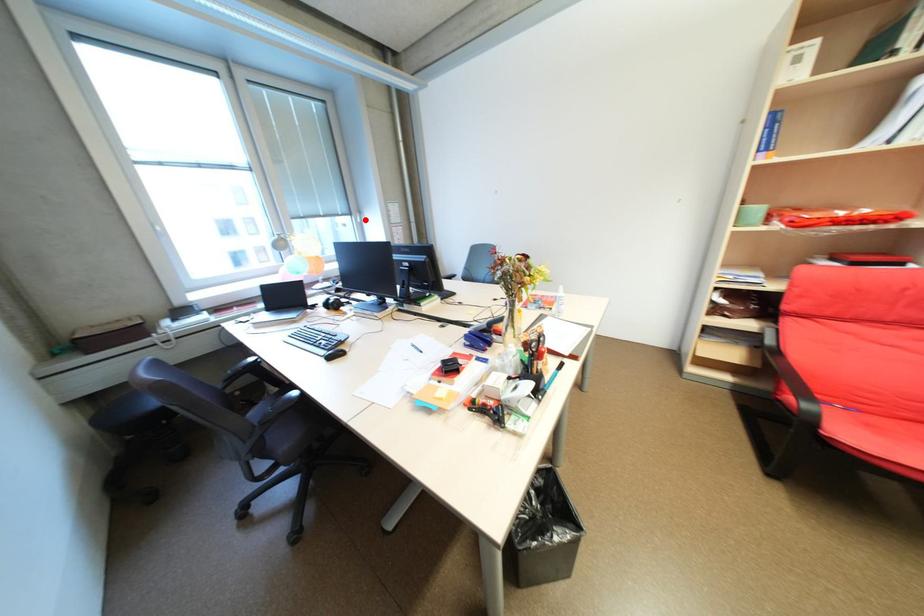
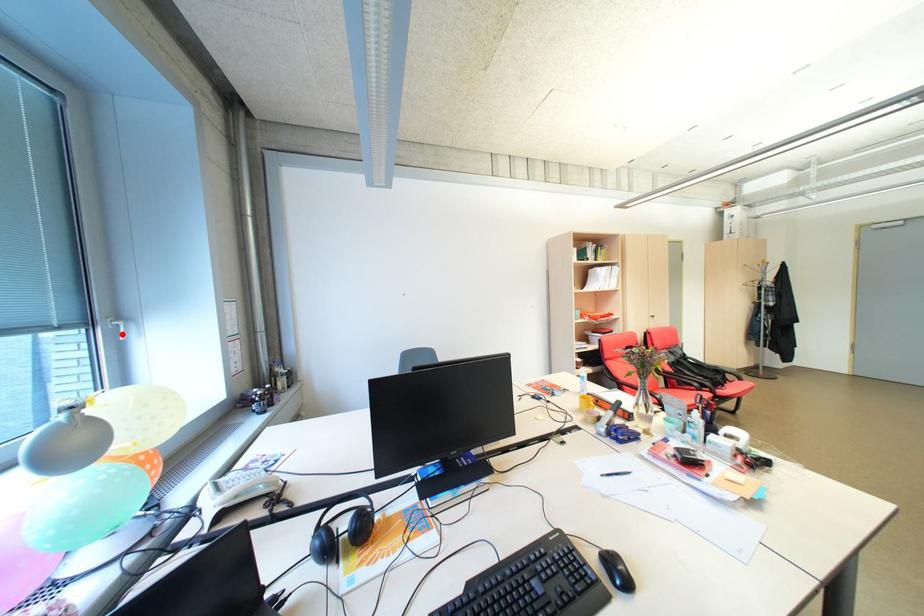
I am providing you with two images of the same scene from different viewpoints. A red point is marked on the first image and another point is marked on the second image. Do the highlighted points in image1 and image2 indicate the same real-world spot?

Yes